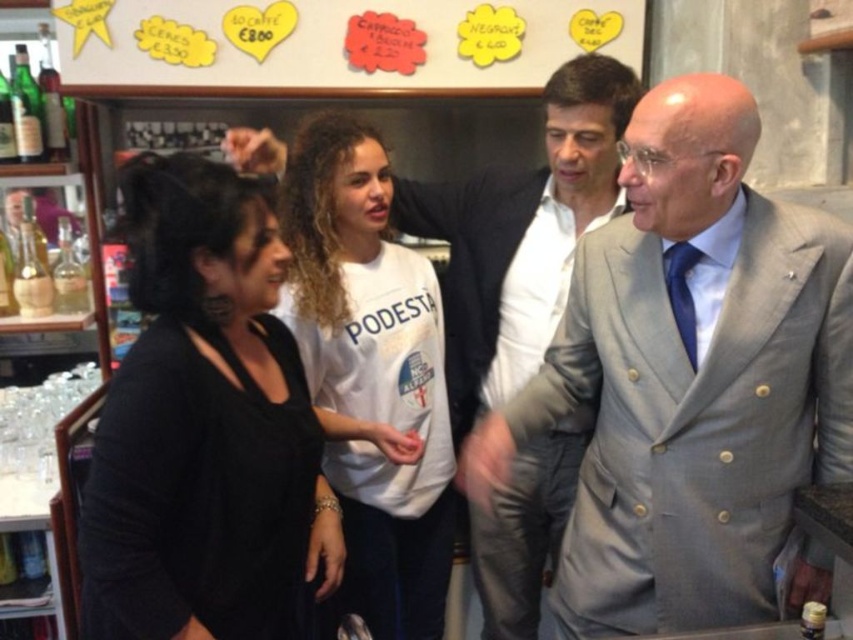
Question: Which object is closer to the camera taking this photo?

Choices:
 (A) gray wool suit at center
 (B) white paperboard at upper center

Answer: (A)

Question: Is gray wool suit at center positioned before white paperboard at upper center?

Choices:
 (A) yes
 (B) no

Answer: (A)

Question: Which of the following is the farthest from the observer?

Choices:
 (A) (212, 92)
 (B) (358, 529)
 (C) (518, 465)

Answer: (A)

Question: Does light gray suit at center appear under white paperboard at upper center?

Choices:
 (A) no
 (B) yes

Answer: (B)

Question: Considering the relative positions of gray wool suit at center and light gray suit at center in the image provided, where is gray wool suit at center located with respect to light gray suit at center?

Choices:
 (A) above
 (B) below

Answer: (B)

Question: Which of the following is the closest to the observer?

Choices:
 (A) (161, 596)
 (B) (231, 76)
 (C) (598, 289)
 (D) (589, 180)

Answer: (A)